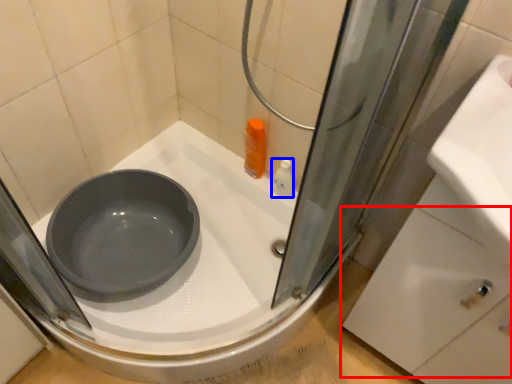
Question: Which point is further to the camera, drawer (highlighted by a red box) or toiletry (highlighted by a blue box)?

Choices:
 (A) drawer
 (B) toiletry

Answer: (B)